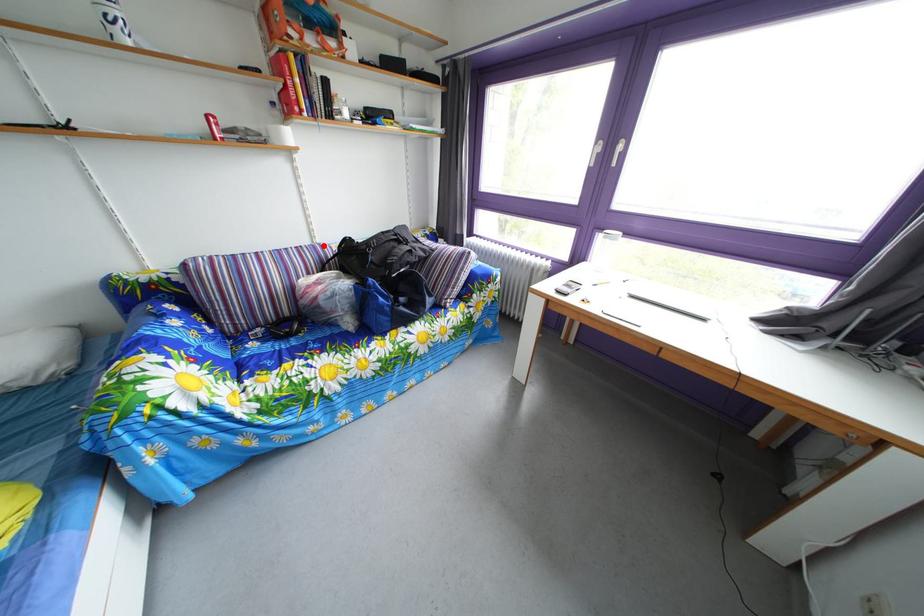
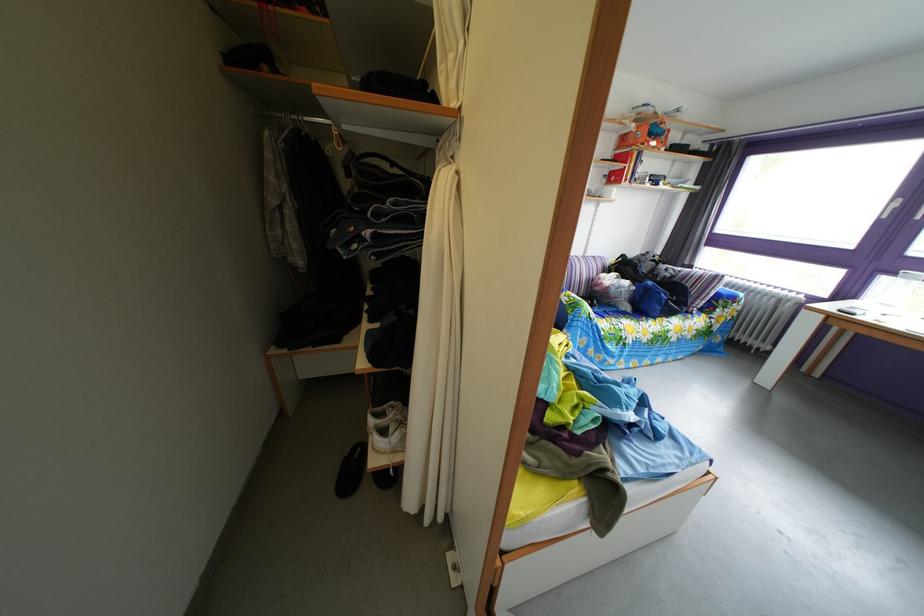
The point at the highlighted location is marked in the first image. Where is the corresponding point in the second image?

(596, 261)